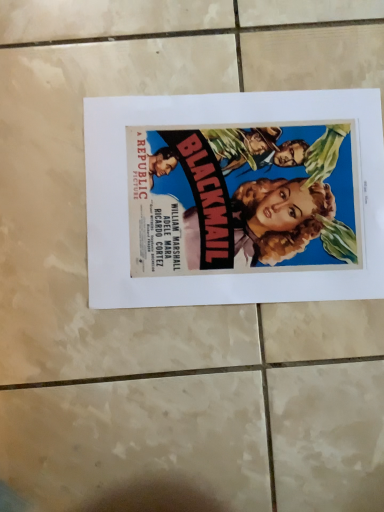
Locate an element on the screen. The image size is (384, 512). vacant area on top of matte paper poster at center (from a real-world perspective) is located at coordinates (235, 194).